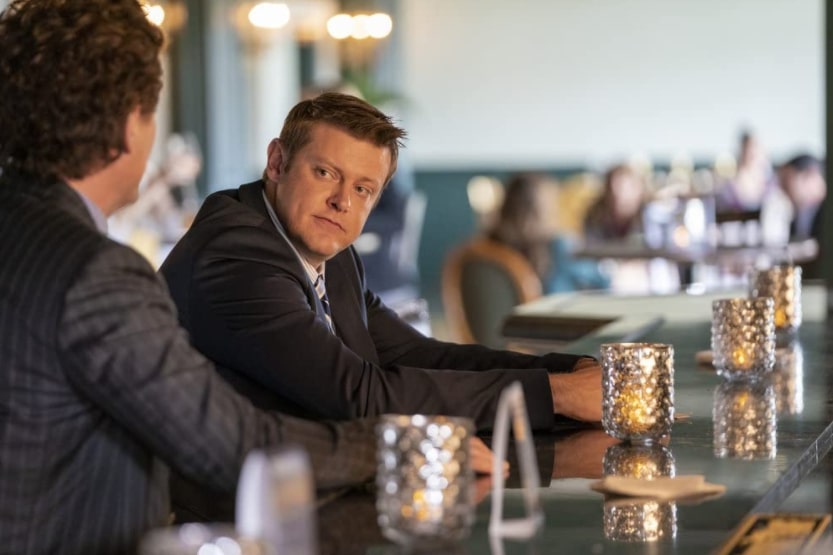
Find the location of a particular element. This screenshot has height=555, width=833. chairs is located at coordinates (504, 280), (407, 233).